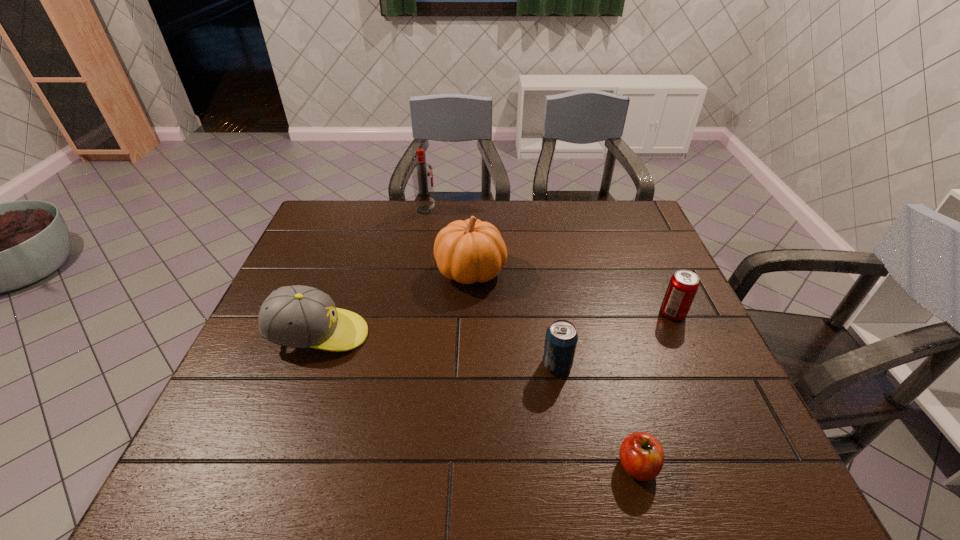
Find the location of a particular element. the tallest object is located at coordinates (422, 173).

The image size is (960, 540). I want to click on vodka, so click(422, 173).

The width and height of the screenshot is (960, 540). In order to click on the fifth shortest object in this screenshot , I will do `click(469, 251)`.

Find the location of a particular element. pumpkin is located at coordinates (469, 251).

I want to click on baseball cap, so click(x=297, y=316).

This screenshot has width=960, height=540. What are the coordinates of `the right pop soda` in the screenshot? It's located at tap(683, 285).

Find the location of a particular element. the rightmost object is located at coordinates (683, 285).

This screenshot has width=960, height=540. I want to click on the left pop soda, so click(x=561, y=338).

Where is `the nearer pop soda`? The height and width of the screenshot is (540, 960). the nearer pop soda is located at coordinates (561, 338).

Image resolution: width=960 pixels, height=540 pixels. I want to click on the shortest object, so click(x=641, y=455).